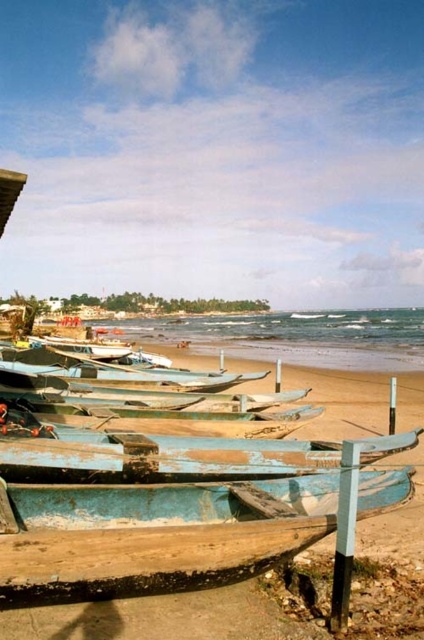
Looking at this image, you are standing at the center of the beach and want to walk to the blue wooden boats at lower center. What direction should you head towards?

The blue wooden boats at lower center are located at point (167, 572). Since you are at the center of the beach, you should head towards the lower part of the beach to reach them.